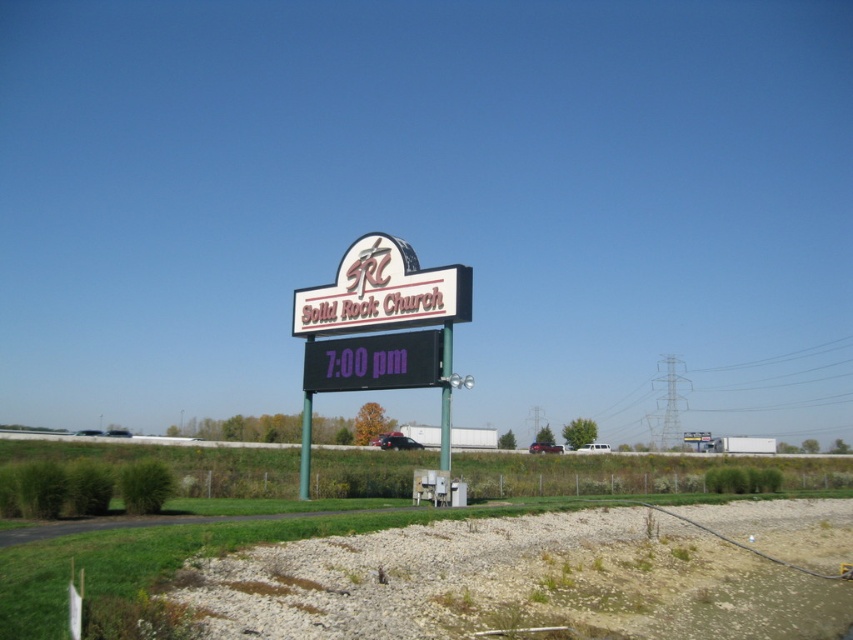
Is metallic sign at center to the right of black digital clock at center from the viewer's perspective?

Incorrect, metallic sign at center is not on the right side of black digital clock at center.

Which of these two, metallic sign at center or black digital clock at center, stands shorter?

With less height is black digital clock at center.

Who is more forward, (407,284) or (318,371)?

Point (407,284) is more forward.

The height and width of the screenshot is (640, 853). In order to click on metallic sign at center in this screenshot , I will do `click(381, 328)`.

Is metallic sign at center smaller than white plastic sign at center?

Incorrect, metallic sign at center is not smaller in size than white plastic sign at center.

Between point (339, 296) and point (460, 308), which one is positioned in front?

Positioned in front is point (460, 308).

At what (x,y) coordinates should I click in order to perform the action: click on metallic sign at center. Please return your answer as a coordinate pair (x, y). Looking at the image, I should click on (381, 328).

Does white plastic sign at center have a smaller size compared to black digital clock at center?

Incorrect, white plastic sign at center is not smaller in size than black digital clock at center.

Who is shorter, white plastic sign at center or black digital clock at center?

With less height is black digital clock at center.

Identify the location of white plastic sign at center. The width and height of the screenshot is (853, 640). (381, 291).

The width and height of the screenshot is (853, 640). I want to click on white plastic sign at center, so click(381, 291).